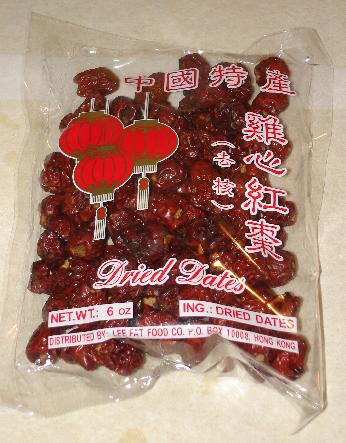
The image size is (346, 443). What are the coordinates of `red lanterns` in the screenshot? It's located at (92, 129), (103, 165), (141, 140).